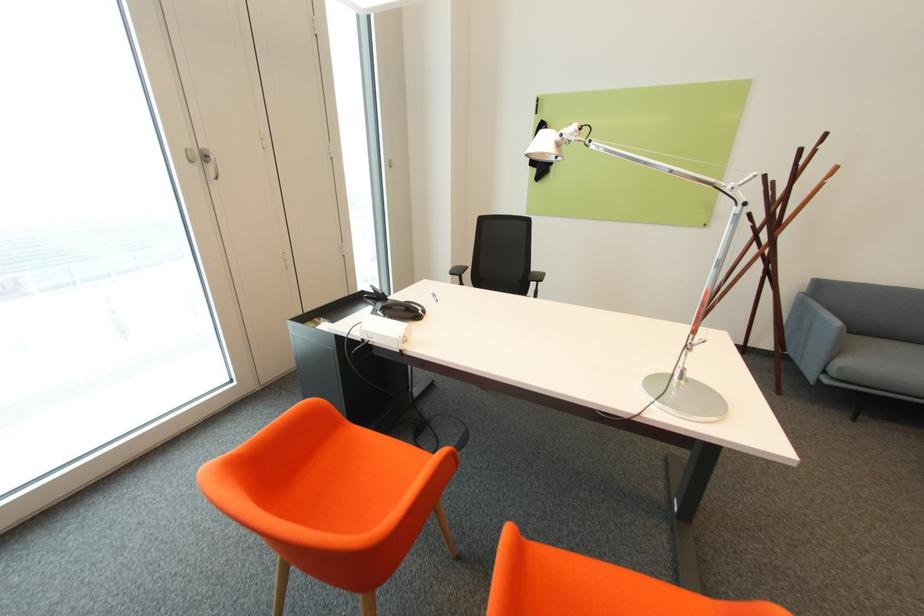
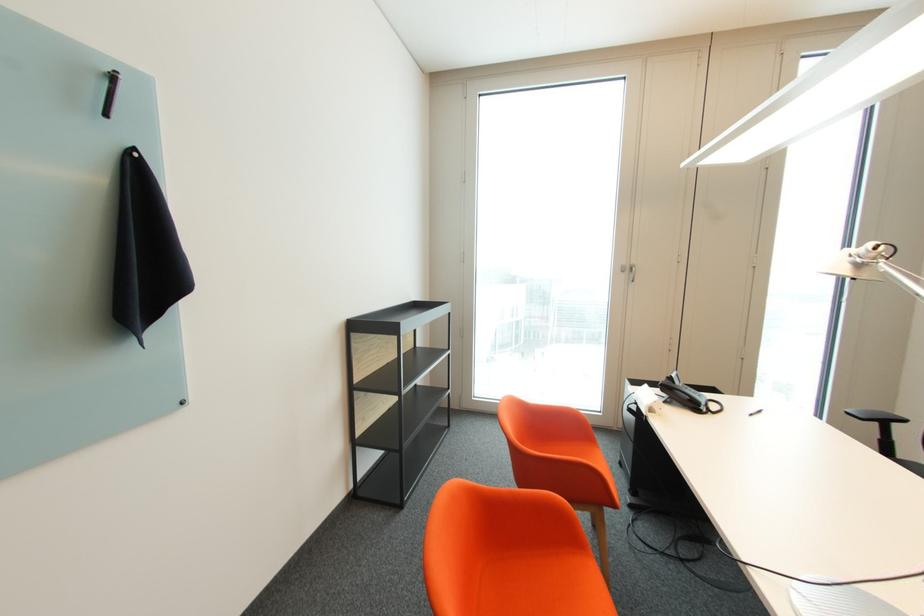
Find the pixel in the second image that matches point (198, 161) in the first image.

(629, 272)